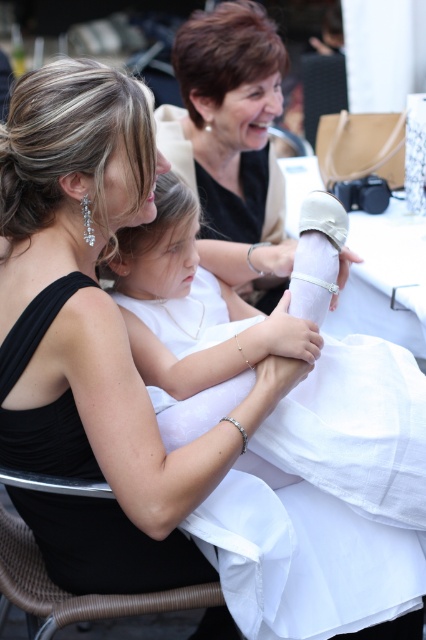
Question: Can you confirm if matte black dress at upper center is positioned to the left of white satin dress at center?

Choices:
 (A) yes
 (B) no

Answer: (B)

Question: Is matte black dress at upper center smaller than white satin dress at center?

Choices:
 (A) no
 (B) yes

Answer: (A)

Question: Which of the following is the closest to the observer?

Choices:
 (A) white satin tablecloth at center
 (B) white satin dress at center
 (C) matte black dress at upper center

Answer: (B)

Question: Which object is farther from the camera taking this photo?

Choices:
 (A) matte black dress at upper center
 (B) white satin tablecloth at center

Answer: (A)

Question: Does matte black dress at upper center appear on the right side of white satin dress at center?

Choices:
 (A) yes
 (B) no

Answer: (A)

Question: Which of the following is the farthest from the observer?

Choices:
 (A) (249, 227)
 (B) (69, 516)
 (C) (353, 292)

Answer: (C)